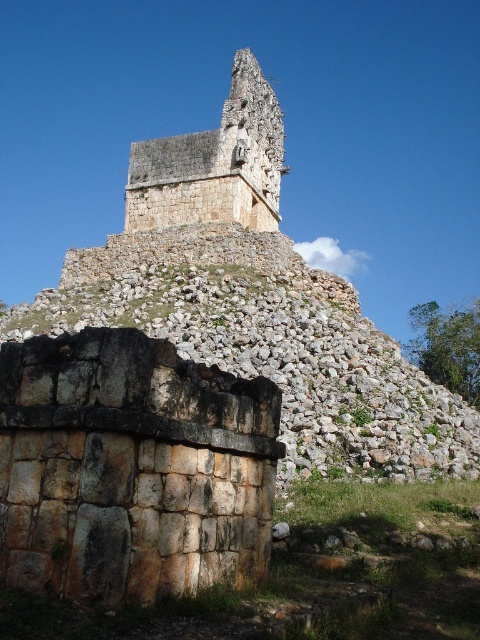
Question: Among these points, which one is nearest to the camera?

Choices:
 (A) pyautogui.click(x=261, y=108)
 (B) pyautogui.click(x=48, y=344)

Answer: (B)

Question: Which of the following is the closest to the observer?

Choices:
 (A) (19, 458)
 (B) (189, 224)

Answer: (A)

Question: Which point is closer to the camera taking this photo?

Choices:
 (A) (183, 218)
 (B) (96, 362)

Answer: (B)

Question: Can you confirm if rustic stone wall at lower left is positioned below rough stone structure at upper center?

Choices:
 (A) yes
 (B) no

Answer: (A)

Question: Is rustic stone wall at lower left above rough stone structure at upper center?

Choices:
 (A) yes
 (B) no

Answer: (B)

Question: Can you confirm if rustic stone wall at lower left is thinner than rough stone structure at upper center?

Choices:
 (A) no
 (B) yes

Answer: (B)